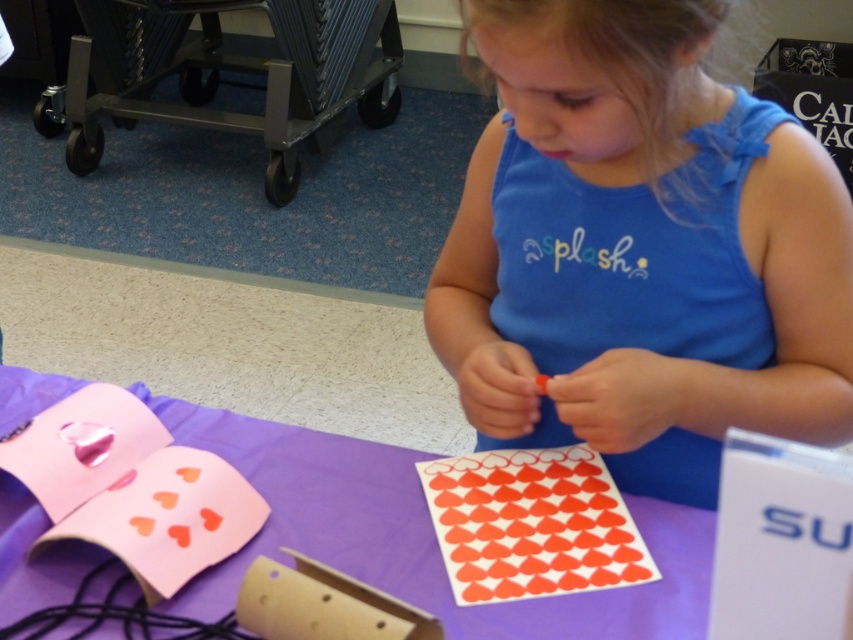
Is blue cotton shirt at center smaller than red glossy heart stickers at center?

No, blue cotton shirt at center is not smaller than red glossy heart stickers at center.

This screenshot has height=640, width=853. What do you see at coordinates (640, 250) in the screenshot?
I see `blue cotton shirt at center` at bounding box center [640, 250].

Find the location of `blue cotton shirt at center`. blue cotton shirt at center is located at coordinates (640, 250).

Between purple fabric table at center and red glossy heart stickers at center, which one has less height?

With less height is red glossy heart stickers at center.

Can you confirm if purple fabric table at center is positioned below red glossy heart stickers at center?

Correct, purple fabric table at center is located below red glossy heart stickers at center.

I want to click on purple fabric table at center, so click(419, 536).

Where is `purple fabric table at center`? This screenshot has height=640, width=853. purple fabric table at center is located at coordinates (419, 536).

Is point (634, 474) positioned after point (222, 605)?

Yes, it is behind point (222, 605).

Does blue cotton shirt at center appear on the left side of purple fabric table at center?

In fact, blue cotton shirt at center is to the right of purple fabric table at center.

Image resolution: width=853 pixels, height=640 pixels. I want to click on blue cotton shirt at center, so click(640, 250).